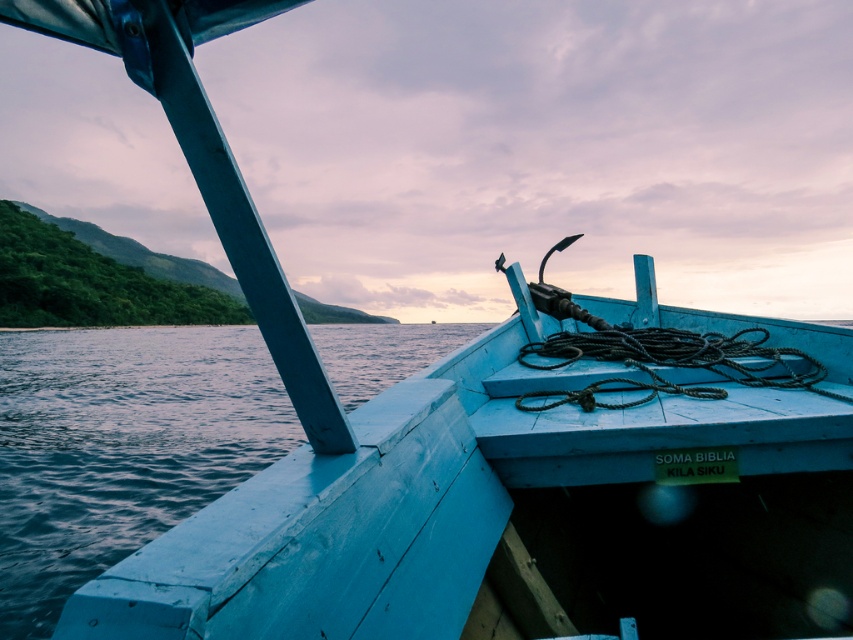
Which is in front, point (42, 625) or point (743, 330)?

Point (42, 625) is more forward.

Image resolution: width=853 pixels, height=640 pixels. Describe the element at coordinates (120, 448) in the screenshot. I see `blue wooden water at lower left` at that location.

Find the location of a particular element. The height and width of the screenshot is (640, 853). blue wooden water at lower left is located at coordinates [x=120, y=448].

Image resolution: width=853 pixels, height=640 pixels. In order to click on blue wooden water at lower left in this screenshot , I will do `click(120, 448)`.